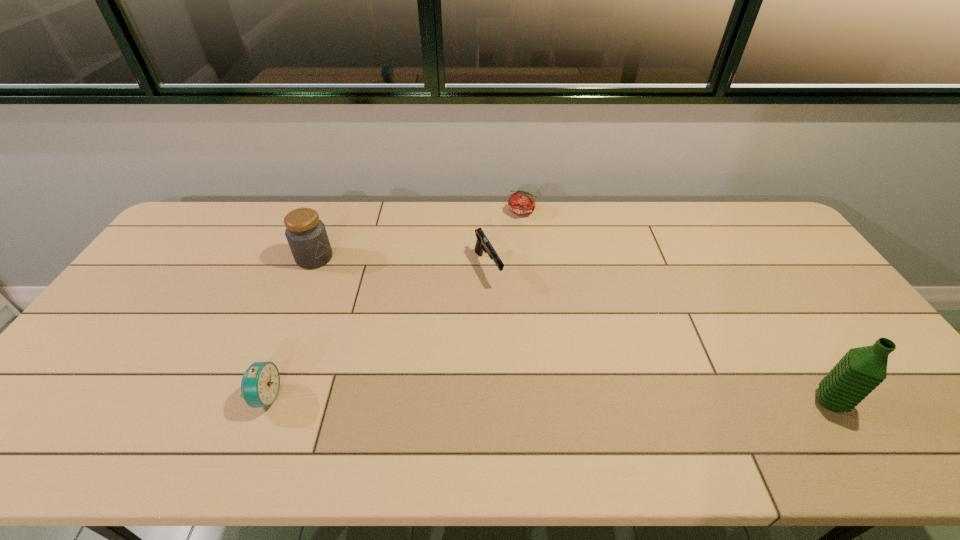
At what (x,y) coordinates should I click in order to perform the action: click on free point between the alarm clock and the rightmost object. Please return your answer as a coordinate pair (x, y). The height and width of the screenshot is (540, 960). Looking at the image, I should click on click(547, 399).

Locate an element on the screen. free point between the rightmost object and the alarm clock is located at coordinates (547, 399).

The width and height of the screenshot is (960, 540). I want to click on free space between the tomato and the gun, so click(x=505, y=240).

Locate an element on the screen. blank region between the gun and the tallest object is located at coordinates (659, 335).

Locate an element on the screen. vacant region between the water bottle and the alarm clock is located at coordinates (547, 399).

Find the location of a particular element. object that ranks as the second closest to the third object from left to right is located at coordinates (307, 237).

This screenshot has width=960, height=540. In order to click on object that is the second closest to the gun in this screenshot , I will do `click(307, 237)`.

Locate an element on the screen. The width and height of the screenshot is (960, 540). free space in the image that satisfies the following two spatial constraints: 1. on the front side of the alarm clock; 2. on the front-facing side of the fourth shortest object is located at coordinates (258, 397).

This screenshot has width=960, height=540. I want to click on vacant space that satisfies the following two spatial constraints: 1. on the back side of the farthest object; 2. on the left side of the jar, so click(333, 212).

Where is `vacant area that satisfies the following two spatial constraints: 1. on the front side of the shortest object; 2. on the right side of the water bottle`? The height and width of the screenshot is (540, 960). vacant area that satisfies the following two spatial constraints: 1. on the front side of the shortest object; 2. on the right side of the water bottle is located at coordinates (543, 402).